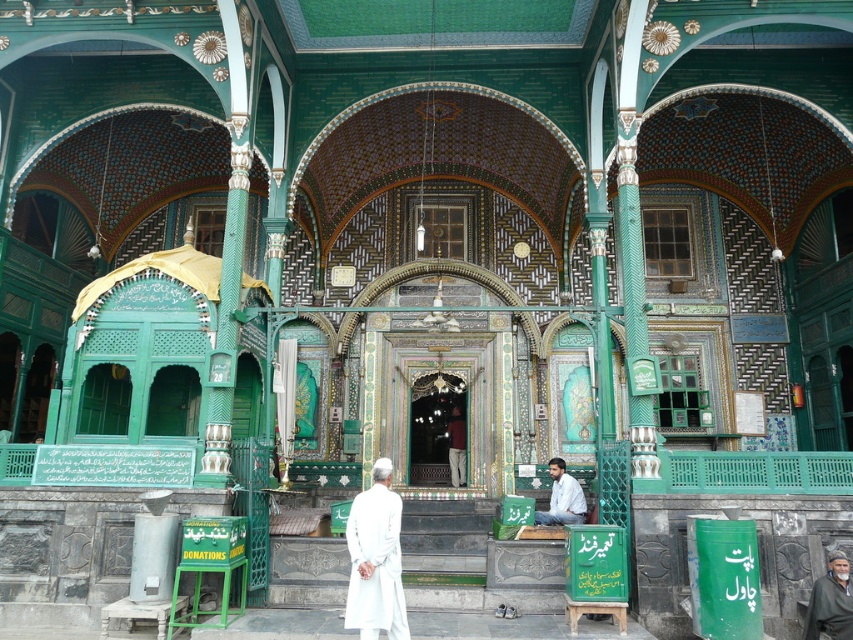
Between point (848, 620) and point (556, 470), which one is positioned in front?

Point (848, 620) is more forward.

From the picture: Between dark green fabric robe at center and white fabric person at center, which one is positioned lower?

dark green fabric robe at center

Which is behind, point (846, 616) or point (573, 520)?

Positioned behind is point (573, 520).

I want to click on dark green fabric robe at center, so click(828, 609).

Is white cotton robe at center positioned in front of white fabric person at center?

Yes, it is in front of white fabric person at center.

Is white cotton robe at center to the left of white fabric person at center from the viewer's perspective?

Yes, white cotton robe at center is to the left of white fabric person at center.

Between point (381, 593) and point (573, 518), which one is positioned behind?

The point (573, 518) is more distant.

The height and width of the screenshot is (640, 853). Identify the location of white cotton robe at center. (375, 564).

Does point (367, 529) lie in front of point (839, 582)?

Yes, it is.

Can you confirm if white cotton robe at center is positioned below dark green fabric robe at center?

No, white cotton robe at center is not below dark green fabric robe at center.

Measure the distance between point (361, 497) and camera.

They are 129.40 feet apart.

This screenshot has height=640, width=853. What are the coordinates of `white cotton robe at center` in the screenshot? It's located at (375, 564).